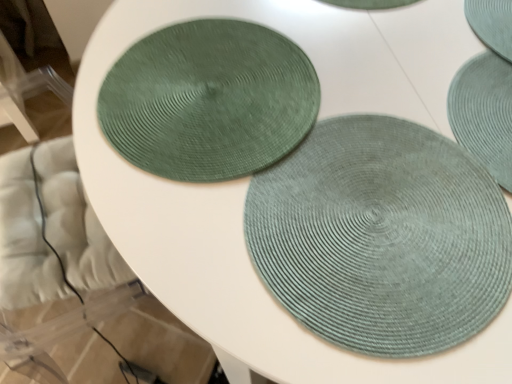
Locate an element on the screen. free area in between green woven coaster at upper left, the 1th coaster when ordered from left to right, and sage green woven mat at center, positioned as the 1th mat in back-to-front order is located at coordinates (377, 125).